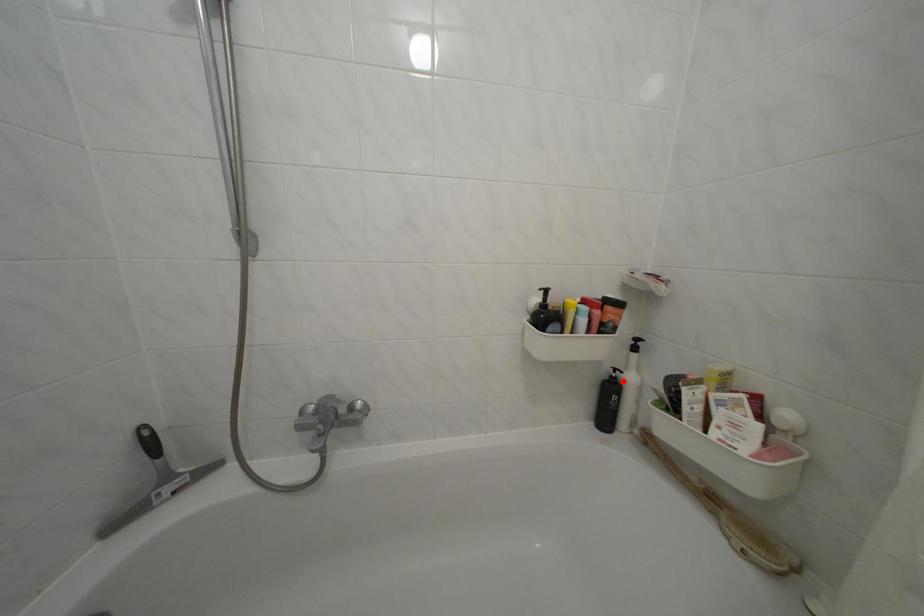
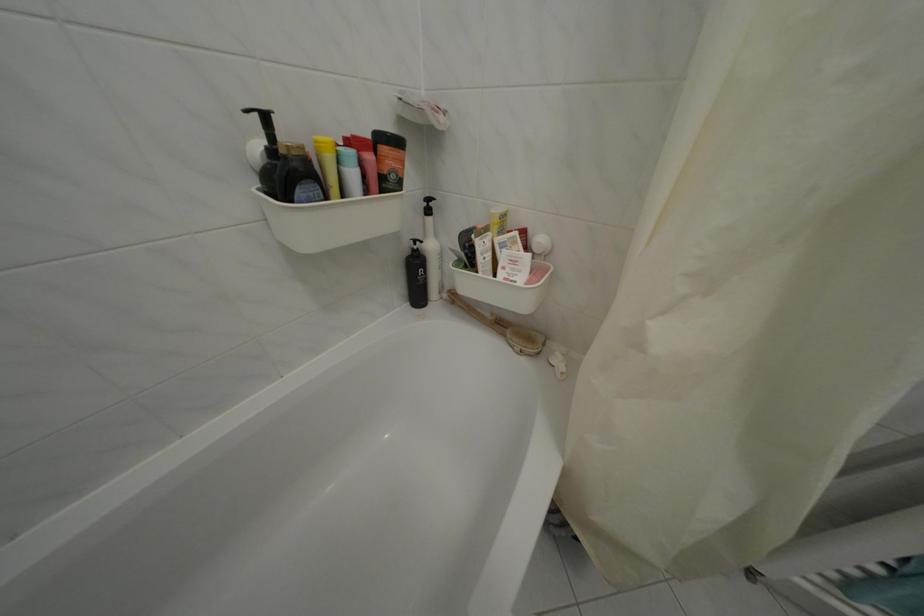
Question: I am providing you with two images of the same scene from different viewpoints. A red point is shown in image1. For the corresponding object point in image2, is it positioned nearer or farther from the camera?

Choices:
 (A) Nearer
 (B) Farther

Answer: (A)